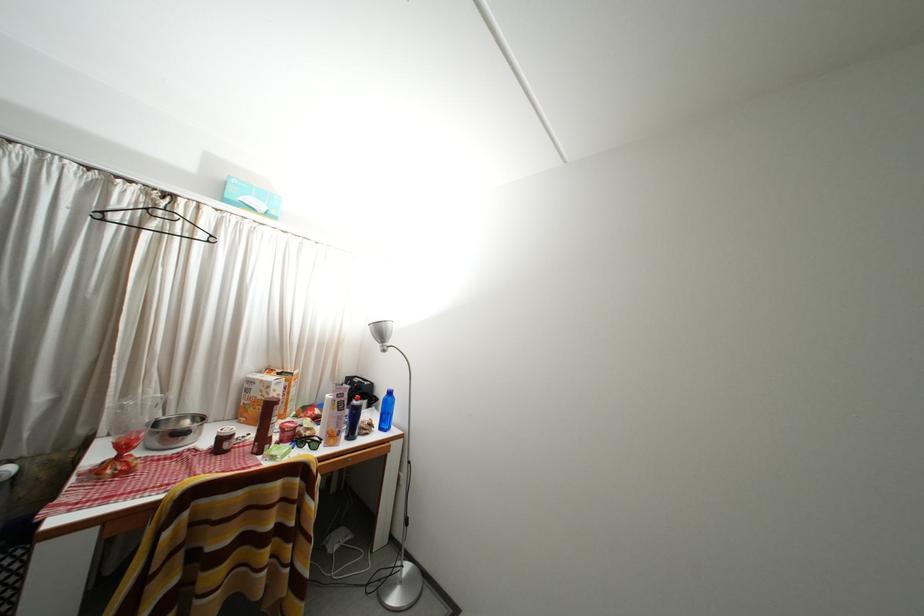
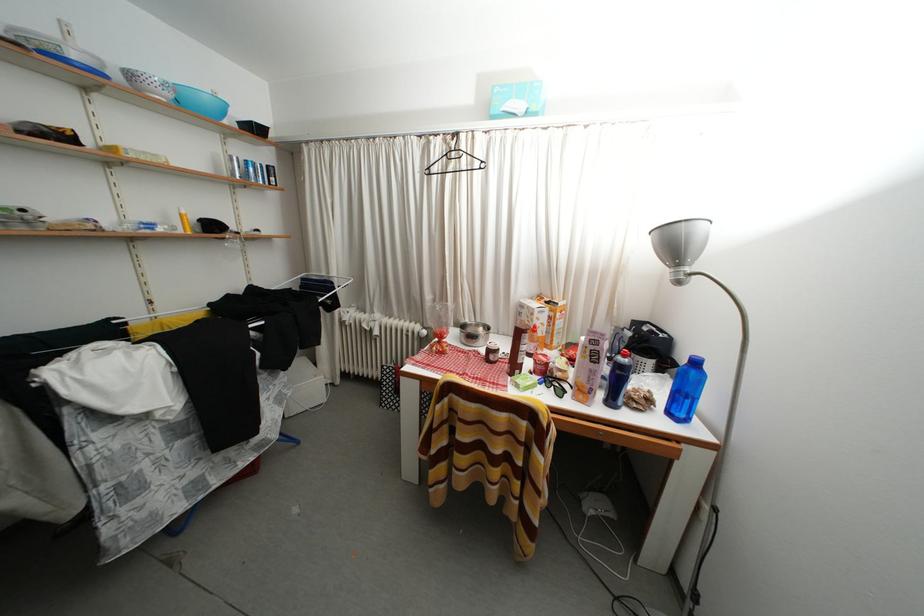
Locate, in the second image, the point that corresponds to (359,442) in the first image.

(618, 408)